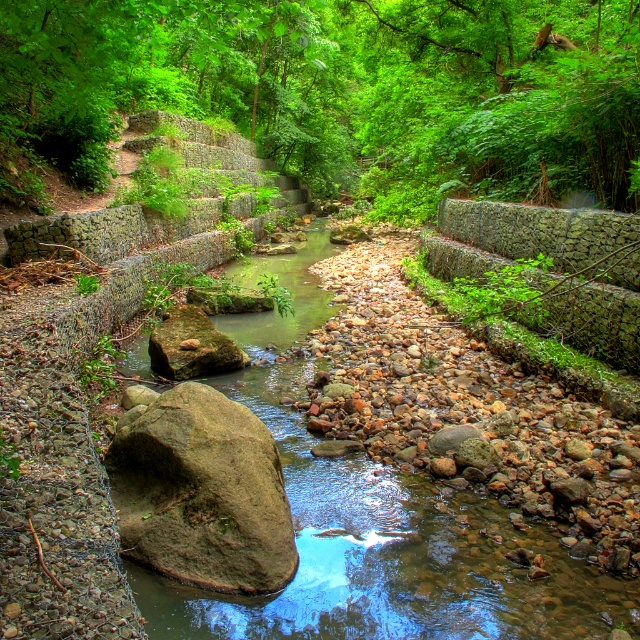
Question: Can you confirm if smooth stone stream at center is positioned above brown rough rock at center?

Choices:
 (A) no
 (B) yes

Answer: (B)

Question: Which object is the farthest from the green leafy forest at center?

Choices:
 (A) smooth stone stream at center
 (B) brown rough rock at center

Answer: (A)

Question: Where is smooth stone stream at center located in relation to brown rough rock at center in the image?

Choices:
 (A) below
 (B) above

Answer: (B)

Question: Does smooth stone stream at center have a lesser width compared to brown rough rock at center?

Choices:
 (A) yes
 (B) no

Answer: (B)

Question: Based on their relative distances, which object is nearer to the brown rough rock at center?

Choices:
 (A) green leafy forest at center
 (B) smooth stone stream at center

Answer: (B)

Question: Estimate the real-world distances between objects in this image. Which object is farther from the brown rough rock at center?

Choices:
 (A) green leafy forest at center
 (B) smooth stone stream at center

Answer: (A)